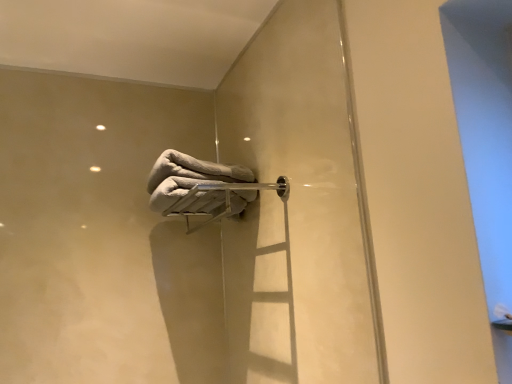
What do you see at coordinates (226, 198) in the screenshot? I see `satin silver towel bar at center` at bounding box center [226, 198].

Locate an element on the screen. satin silver towel bar at center is located at coordinates (226, 198).

Where is `gray fluffy towel at center`? Image resolution: width=512 pixels, height=384 pixels. gray fluffy towel at center is located at coordinates (187, 177).

Describe the element at coordinates (187, 177) in the screenshot. I see `gray fluffy towel at center` at that location.

Where is `satin silver towel bar at center`? The height and width of the screenshot is (384, 512). satin silver towel bar at center is located at coordinates (226, 198).

Which object is positioned more to the right, gray fluffy towel at center or satin silver towel bar at center?

From the viewer's perspective, satin silver towel bar at center appears more on the right side.

Considering the positions of objects gray fluffy towel at center and satin silver towel bar at center in the image provided, who is in front, gray fluffy towel at center or satin silver towel bar at center?

satin silver towel bar at center is closer to the camera.

Which point is more distant from viewer, (x=162, y=160) or (x=219, y=183)?

The point (x=219, y=183) is behind.

From the image's perspective, relative to satin silver towel bar at center, is gray fluffy towel at center above or below?

gray fluffy towel at center is situated higher than satin silver towel bar at center in the image.

From a real-world perspective, between gray fluffy towel at center and satin silver towel bar at center, who is vertically higher?

gray fluffy towel at center.

Does gray fluffy towel at center have a greater width compared to satin silver towel bar at center?

Yes.

Considering the relative sizes of gray fluffy towel at center and satin silver towel bar at center in the image provided, is gray fluffy towel at center shorter than satin silver towel bar at center?

No, gray fluffy towel at center is not shorter than satin silver towel bar at center.

Is gray fluffy towel at center smaller than satin silver towel bar at center?

Correct, gray fluffy towel at center occupies less space than satin silver towel bar at center.

Is satin silver towel bar at center inside gray fluffy towel at center?

That's incorrect, satin silver towel bar at center is not inside gray fluffy towel at center.

Is the surface of gray fluffy towel at center in direct contact with satin silver towel bar at center?

Yes, gray fluffy towel at center is in contact with satin silver towel bar at center.

Consider the image. Is gray fluffy towel at center oriented towards satin silver towel bar at center?

No.

What's the angular difference between gray fluffy towel at center and satin silver towel bar at center's facing directions?

The angular difference between gray fluffy towel at center and satin silver towel bar at center is 7.5e-05 degrees.

Find the location of `towel bar in front of the gray fluffy towel at center`. towel bar in front of the gray fluffy towel at center is located at coordinates (226, 198).

Considering the positions of objects satin silver towel bar at center and gray fluffy towel at center in the image provided, who is more to the right, satin silver towel bar at center or gray fluffy towel at center?

satin silver towel bar at center is more to the right.

Looking at this image, is satin silver towel bar at center closer to the viewer compared to gray fluffy towel at center?

Yes, the depth of satin silver towel bar at center is less than that of gray fluffy towel at center.

Considering the positions of points (223, 186) and (188, 176), is point (223, 186) farther from camera compared to point (188, 176)?

Yes, it is behind point (188, 176).

From the image's perspective, does satin silver towel bar at center appear higher than gray fluffy towel at center?

No, from the image's perspective, satin silver towel bar at center is not above gray fluffy towel at center.

From a real-world perspective, between satin silver towel bar at center and gray fluffy towel at center, who is vertically lower?

In real-world perspective, satin silver towel bar at center is lower.

Considering the sizes of objects satin silver towel bar at center and gray fluffy towel at center in the image provided, who is thinner, satin silver towel bar at center or gray fluffy towel at center?

satin silver towel bar at center is thinner.

From their relative heights in the image, would you say satin silver towel bar at center is taller or shorter than gray fluffy towel at center?

Clearly, satin silver towel bar at center is shorter compared to gray fluffy towel at center.

Who is smaller, satin silver towel bar at center or gray fluffy towel at center?

With smaller size is gray fluffy towel at center.

Does satin silver towel bar at center contain gray fluffy towel at center?

That's incorrect, gray fluffy towel at center is not inside satin silver towel bar at center.

Is satin silver towel bar at center with gray fluffy towel at center?

Yes, the surface of satin silver towel bar at center is in contact with gray fluffy towel at center.

Is satin silver towel bar at center facing towards gray fluffy towel at center?

No, satin silver towel bar at center is not aimed at gray fluffy towel at center.

Locate an element on the screen. This screenshot has height=384, width=512. towel behind the satin silver towel bar at center is located at coordinates (187, 177).

Where is `towel behind the satin silver towel bar at center`? This screenshot has width=512, height=384. towel behind the satin silver towel bar at center is located at coordinates (187, 177).

Locate an element on the screen. towel on the left side of satin silver towel bar at center is located at coordinates (187, 177).